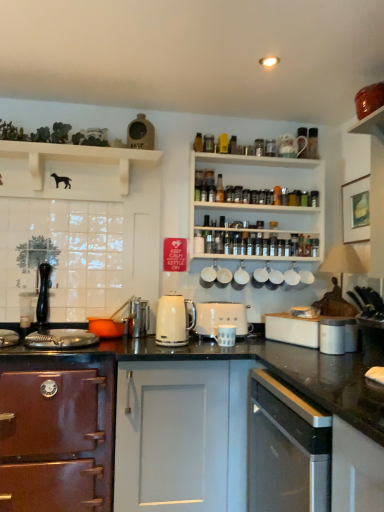
Locate an element on the screen. Image resolution: width=384 pixels, height=512 pixels. free space above white wooden shelf at upper center, which appears as the 2th shelf when viewed from the left (from a real-world perspective) is located at coordinates (269, 141).